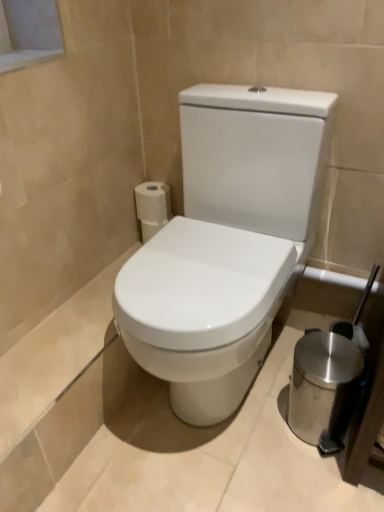
This screenshot has width=384, height=512. What do you see at coordinates (152, 207) in the screenshot? I see `white matte toilet paper at upper left` at bounding box center [152, 207].

Locate an element on the screen. This screenshot has height=512, width=384. polished stainless steel trash can at lower right is located at coordinates pos(324,388).

Does white glossy toilet at center have a lesser height compared to white matte toilet paper at upper left?

Incorrect, the height of white glossy toilet at center does not fall short of that of white matte toilet paper at upper left.

Which is behind, point (304, 184) or point (142, 204)?

The point (142, 204) is more distant.

Based on the photo, visually, is white glossy toilet at center positioned to the left or to the right of white matte toilet paper at upper left?

white glossy toilet at center is positioned on white matte toilet paper at upper left's right side.

Is white glossy toilet at center with white matte toilet paper at upper left?

There is a gap between white glossy toilet at center and white matte toilet paper at upper left.

From the image's perspective, would you say polished stainless steel trash can at lower right is positioned over white matte toilet paper at upper left?

No, from the image's perspective, polished stainless steel trash can at lower right is not above white matte toilet paper at upper left.

From a real-world perspective, is polished stainless steel trash can at lower right above or below white matte toilet paper at upper left?

Clearly, from a real-world perspective, polished stainless steel trash can at lower right is below white matte toilet paper at upper left.

Who is more distant, polished stainless steel trash can at lower right or white matte toilet paper at upper left?

white matte toilet paper at upper left is more distant.

Does point (293, 362) come closer to viewer compared to point (160, 196)?

Yes, it is in front of point (160, 196).

From a real-world perspective, is polished stainless steel trash can at lower right physically above white glossy toilet at center?

No, from a real-world perspective, polished stainless steel trash can at lower right is not above white glossy toilet at center.

Is polished stainless steel trash can at lower right positioned before white glossy toilet at center?

No, polished stainless steel trash can at lower right is further to the viewer.

Find the location of a particular element. toilet on the left of polished stainless steel trash can at lower right is located at coordinates (226, 243).

Considering the sizes of polished stainless steel trash can at lower right and white glossy toilet at center in the image, is polished stainless steel trash can at lower right taller or shorter than white glossy toilet at center?

In the image, polished stainless steel trash can at lower right appears to be shorter than white glossy toilet at center.

Considering the relative positions of white glossy toilet at center and polished stainless steel trash can at lower right in the image provided, is white glossy toilet at center behind polished stainless steel trash can at lower right?

No, it is in front of polished stainless steel trash can at lower right.

How many degrees apart are the facing directions of white glossy toilet at center and polished stainless steel trash can at lower right?

0.0892 degrees separate the facing orientations of white glossy toilet at center and polished stainless steel trash can at lower right.

Is white glossy toilet at center bigger or smaller than polished stainless steel trash can at lower right?

Considering their sizes, white glossy toilet at center takes up more space than polished stainless steel trash can at lower right.

Does white matte toilet paper at upper left appear on the left side of polished stainless steel trash can at lower right?

Correct, you'll find white matte toilet paper at upper left to the left of polished stainless steel trash can at lower right.

From the image's perspective, is white matte toilet paper at upper left over polished stainless steel trash can at lower right?

Yes, from the image's perspective, white matte toilet paper at upper left is over polished stainless steel trash can at lower right.

Can polished stainless steel trash can at lower right be found inside white matte toilet paper at upper left?

That's incorrect, polished stainless steel trash can at lower right is not inside white matte toilet paper at upper left.

Is white matte toilet paper at upper left beside polished stainless steel trash can at lower right?

white matte toilet paper at upper left and polished stainless steel trash can at lower right are not in contact.

You are a GUI agent. You are given a task and a screenshot of the screen. Output one action in this format:
    pyautogui.click(x=<x>, y=<y>)
    Task: Click on the toilet in front of the white matte toilet paper at upper left
    
    Given the screenshot: What is the action you would take?
    pyautogui.click(x=226, y=243)

Which is more to the left, white matte toilet paper at upper left or white glossy toilet at center?

white matte toilet paper at upper left is more to the left.

Which of these two, white matte toilet paper at upper left or white glossy toilet at center, stands shorter?

With less height is white matte toilet paper at upper left.

Between white matte toilet paper at upper left and white glossy toilet at center, which one is positioned in front?

white glossy toilet at center is closer to the camera.

What are the coordinates of `toilet to the right of white matte toilet paper at upper left` in the screenshot? It's located at (226, 243).

The image size is (384, 512). I want to click on appliance below the white matte toilet paper at upper left (from a real-world perspective), so click(324, 388).

Estimate the real-world distances between objects in this image. Which object is further from white glossy toilet at center, white matte toilet paper at upper left or polished stainless steel trash can at lower right?

Based on the image, white matte toilet paper at upper left appears to be further to white glossy toilet at center.

Considering their positions, is white glossy toilet at center positioned further to white matte toilet paper at upper left than polished stainless steel trash can at lower right?

polished stainless steel trash can at lower right is further to white matte toilet paper at upper left.

Looking at this image, when comparing their distances from polished stainless steel trash can at lower right, does white matte toilet paper at upper left or white glossy toilet at center seem further?

white matte toilet paper at upper left is further to polished stainless steel trash can at lower right.

Looking at the image, which one is located further to white glossy toilet at center, polished stainless steel trash can at lower right or white matte toilet paper at upper left?

white matte toilet paper at upper left is further to white glossy toilet at center.

Based on the photo, based on their spatial positions, is polished stainless steel trash can at lower right or white glossy toilet at center closer to white matte toilet paper at upper left?

white glossy toilet at center is closer to white matte toilet paper at upper left.

From the image, which object appears to be nearer to polished stainless steel trash can at lower right, white glossy toilet at center or white matte toilet paper at upper left?

The object closer to polished stainless steel trash can at lower right is white glossy toilet at center.

This screenshot has width=384, height=512. Find the location of `appliance between white glossy toilet at center and white matte toilet paper at upper left from front to back`. appliance between white glossy toilet at center and white matte toilet paper at upper left from front to back is located at coordinates (324, 388).